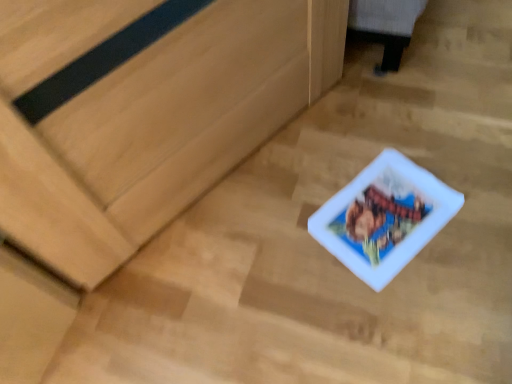
The width and height of the screenshot is (512, 384). I want to click on vacant region above white glossy comic book at center (from a real-world perspective), so click(x=384, y=211).